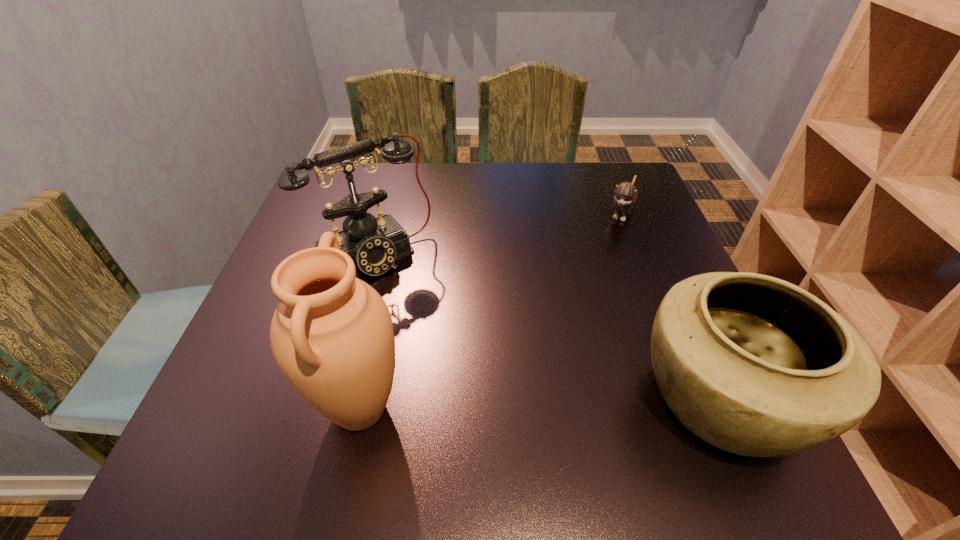
Where is `urn`? This screenshot has height=540, width=960. urn is located at coordinates (332, 336).

The width and height of the screenshot is (960, 540). Find the location of `the second shortest object`. the second shortest object is located at coordinates (754, 365).

Find the location of a particular element. kitten is located at coordinates (625, 196).

The image size is (960, 540). Find the location of `the third shortest object`. the third shortest object is located at coordinates (374, 244).

Locate an element on the screen. This screenshot has height=540, width=960. vacant space positioned 0.060m on the right of the urn is located at coordinates (444, 409).

At what (x,y) coordinates should I click in order to perform the action: click on vacant region located 0.180m on the back of the third tallest object. Please return your answer as a coordinate pair (x, y). The width and height of the screenshot is (960, 540). Looking at the image, I should click on (664, 267).

I want to click on vacant space located 0.380m on the front-facing side of the shortest object, so click(565, 338).

Identify the location of vacant space situated 0.110m on the front-facing side of the shortest object. The image size is (960, 540). (606, 255).

You are a GUI agent. You are given a task and a screenshot of the screen. Output one action in this format:
    pyautogui.click(x=<x>, y=<y>)
    Task: Click on the vacant point located 0.200m on the front-facing side of the shortest object
    Image resolution: width=960 pixels, height=540 pixels.
    Given the screenshot: What is the action you would take?
    pyautogui.click(x=594, y=279)

Identify the location of vacant space located on the dial of the telephone. This screenshot has height=540, width=960. (498, 399).